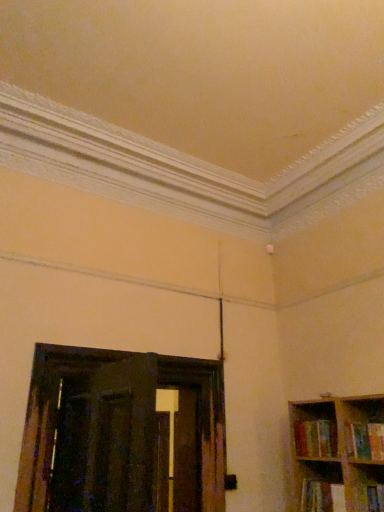
How much space does multicolored paperbacks at right, the second book when ordered from bottom to top, occupy horizontally?

It is 19.12 centimeters.

In order to face multicolored fabric book at lower right, which appears as the third book when viewed from the top, should I rotate leftwards or rightwards?

To align with it, rotate right about 17.764°.

What do you see at coordinates (364, 440) in the screenshot? Image resolution: width=384 pixels, height=512 pixels. I see `hardcover book at right, which is the first book from top to bottom` at bounding box center [364, 440].

Find the location of a particular element. This screenshot has width=384, height=512. multicolored paperbacks at right, the second book when ordered from bottom to top is located at coordinates (315, 438).

Between multicolored paperbacks at right, which is counted as the second book, starting from the top, and hardcover book at right, which is the first book from top to bottom, which one appears on the right side from the viewer's perspective?

hardcover book at right, which is the first book from top to bottom, is more to the right.

Could you tell me if multicolored paperbacks at right, the second book when ordered from bottom to top, is facing hardcover book at right, which is the first book from top to bottom?

No, multicolored paperbacks at right, the second book when ordered from bottom to top, does not turn towards hardcover book at right, which is the first book from top to bottom.

Are multicolored paperbacks at right, which is counted as the second book, starting from the top, and hardcover book at right, which is the first book from top to bottom, far apart?

No, there isn't a large distance between multicolored paperbacks at right, which is counted as the second book, starting from the top, and hardcover book at right, which is the first book from top to bottom.

From the picture: Is multicolored fabric book at lower right, which appears as the third book when viewed from the top, positioned before multicolored paperbacks at right, which is counted as the second book, starting from the top?

Yes, multicolored fabric book at lower right, which appears as the third book when viewed from the top, is in front of multicolored paperbacks at right, which is counted as the second book, starting from the top.

Considering the sizes of multicolored fabric book at lower right, the 1th book positioned from the bottom, and multicolored paperbacks at right, the second book when ordered from bottom to top, in the image, is multicolored fabric book at lower right, the 1th book positioned from the bottom, wider or thinner than multicolored paperbacks at right, the second book when ordered from bottom to top,?

multicolored fabric book at lower right, the 1th book positioned from the bottom, is thinner than multicolored paperbacks at right, the second book when ordered from bottom to top.

Considering the sizes of objects multicolored fabric book at lower right, the 1th book positioned from the bottom, and multicolored paperbacks at right, the second book when ordered from bottom to top, in the image provided, who is shorter, multicolored fabric book at lower right, the 1th book positioned from the bottom, or multicolored paperbacks at right, the second book when ordered from bottom to top,?

Answer: multicolored fabric book at lower right, the 1th book positioned from the bottom, is shorter.

Is multicolored fabric book at lower right, the 1th book positioned from the bottom, positioned beyond the bounds of hardcover book at right, which is the first book from top to bottom?

multicolored fabric book at lower right, the 1th book positioned from the bottom, is positioned outside hardcover book at right, which is the first book from top to bottom.

Looking at their sizes, would you say multicolored fabric book at lower right, which appears as the third book when viewed from the top, is wider or thinner than hardcover book at right, which is the first book from top to bottom?

Clearly, multicolored fabric book at lower right, which appears as the third book when viewed from the top, has less width compared to hardcover book at right, which is the first book from top to bottom.

Locate an element on the screen. The height and width of the screenshot is (512, 384). the 1st book behind the hardcover book at right, acting as the 3th book starting from the bottom is located at coordinates (322, 496).

Is multicolored fabric book at lower right, the 1th book positioned from the bottom, not close to hardcover book at right, acting as the 3th book starting from the bottom?

No, multicolored fabric book at lower right, the 1th book positioned from the bottom, is in close proximity to hardcover book at right, acting as the 3th book starting from the bottom.

Is multicolored paperbacks at right, which is counted as the second book, starting from the top, in contact with multicolored fabric book at lower right, which appears as the third book when viewed from the top?

multicolored paperbacks at right, which is counted as the second book, starting from the top, and multicolored fabric book at lower right, which appears as the third book when viewed from the top, are not in contact.

Choose the correct answer: Is multicolored paperbacks at right, which is counted as the second book, starting from the top, inside multicolored fabric book at lower right, the 1th book positioned from the bottom, or outside it?

multicolored paperbacks at right, which is counted as the second book, starting from the top, lies outside multicolored fabric book at lower right, the 1th book positioned from the bottom.

Is multicolored paperbacks at right, the second book when ordered from bottom to top, at the left side of multicolored fabric book at lower right, which appears as the third book when viewed from the top?

No, multicolored paperbacks at right, the second book when ordered from bottom to top, is not to the left of multicolored fabric book at lower right, which appears as the third book when viewed from the top.

Is hardcover book at right, acting as the 3th book starting from the bottom, turned away from multicolored fabric book at lower right, the 1th book positioned from the bottom?

That's not correct — hardcover book at right, acting as the 3th book starting from the bottom, is not looking away from multicolored fabric book at lower right, the 1th book positioned from the bottom.

In the scene shown: From the image's perspective, is hardcover book at right, which is the first book from top to bottom, above or below multicolored fabric book at lower right, the 1th book positioned from the bottom?

Clearly, from the image's perspective, hardcover book at right, which is the first book from top to bottom, is above multicolored fabric book at lower right, the 1th book positioned from the bottom.

Between hardcover book at right, acting as the 3th book starting from the bottom, and multicolored fabric book at lower right, which appears as the third book when viewed from the top, which one has smaller size?

With smaller size is multicolored fabric book at lower right, which appears as the third book when viewed from the top.

What's the angular difference between hardcover book at right, which is the first book from top to bottom, and multicolored paperbacks at right, which is counted as the second book, starting from the top,'s facing directions?

The angular difference between hardcover book at right, which is the first book from top to bottom, and multicolored paperbacks at right, which is counted as the second book, starting from the top, is 0.00015 degrees.

In terms of width, does hardcover book at right, which is the first book from top to bottom, look wider or thinner when compared to multicolored paperbacks at right, which is counted as the second book, starting from the top?

Clearly, hardcover book at right, which is the first book from top to bottom, has less width compared to multicolored paperbacks at right, which is counted as the second book, starting from the top.

Is the surface of hardcover book at right, which is the first book from top to bottom, in direct contact with multicolored paperbacks at right, which is counted as the second book, starting from the top?

No, hardcover book at right, which is the first book from top to bottom, is not with multicolored paperbacks at right, which is counted as the second book, starting from the top.

Would you say hardcover book at right, acting as the 3th book starting from the bottom, is outside multicolored paperbacks at right, which is counted as the second book, starting from the top?

Yes, hardcover book at right, acting as the 3th book starting from the bottom, is not within multicolored paperbacks at right, which is counted as the second book, starting from the top.

This screenshot has width=384, height=512. There is a hardcover book at right, which is the first book from top to bottom. In order to click on book above it (from a real-world perspective) in this screenshot , I will do `click(315, 438)`.

From the multicolored paperbacks at right, the second book when ordered from bottom to top, count 1st books forward and point to it. Please provide its 2D coordinates.

[(322, 496)]

From the image, which object appears to be farther from hardcover book at right, acting as the 3th book starting from the bottom, multicolored paperbacks at right, the second book when ordered from bottom to top, or multicolored fabric book at lower right, which appears as the third book when viewed from the top?

multicolored fabric book at lower right, which appears as the third book when viewed from the top, is further to hardcover book at right, acting as the 3th book starting from the bottom.

Looking at the image, which one is located closer to multicolored paperbacks at right, the second book when ordered from bottom to top, multicolored fabric book at lower right, the 1th book positioned from the bottom, or hardcover book at right, acting as the 3th book starting from the bottom?

hardcover book at right, acting as the 3th book starting from the bottom, lies closer to multicolored paperbacks at right, the second book when ordered from bottom to top, than the other object.

From the image, which object appears to be farther from multicolored paperbacks at right, the second book when ordered from bottom to top, hardcover book at right, acting as the 3th book starting from the bottom, or multicolored fabric book at lower right, which appears as the third book when viewed from the top?

multicolored fabric book at lower right, which appears as the third book when viewed from the top, is positioned further to the anchor multicolored paperbacks at right, the second book when ordered from bottom to top.

Based on their spatial positions, is multicolored paperbacks at right, which is counted as the second book, starting from the top, or hardcover book at right, which is the first book from top to bottom, closer to multicolored fabric book at lower right, the 1th book positioned from the bottom?

multicolored paperbacks at right, which is counted as the second book, starting from the top.

Which object lies further to the anchor point hardcover book at right, which is the first book from top to bottom, multicolored fabric book at lower right, the 1th book positioned from the bottom, or multicolored paperbacks at right, the second book when ordered from bottom to top?

Based on the image, multicolored fabric book at lower right, the 1th book positioned from the bottom, appears to be further to hardcover book at right, which is the first book from top to bottom.

Looking at the image, which one is located further to multicolored fabric book at lower right, which appears as the third book when viewed from the top, hardcover book at right, which is the first book from top to bottom, or multicolored paperbacks at right, which is counted as the second book, starting from the top?

Among the two, hardcover book at right, which is the first book from top to bottom, is located further to multicolored fabric book at lower right, which appears as the third book when viewed from the top.

Locate an element on the screen. The height and width of the screenshot is (512, 384). book between hardcover book at right, which is the first book from top to bottom, and multicolored fabric book at lower right, the 1th book positioned from the bottom, from top to bottom is located at coordinates (315, 438).